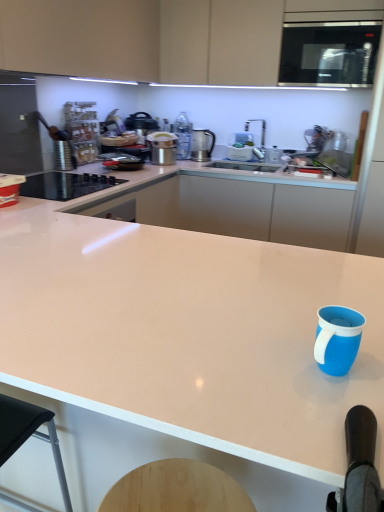
Locate an element on the screen. free space behind blue matte mug at lower right is located at coordinates (286, 315).